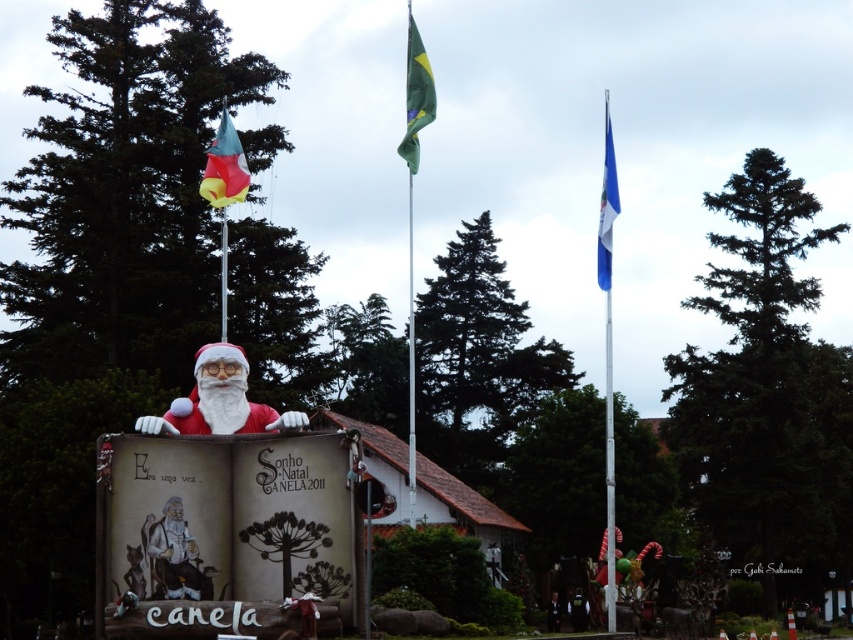
You are a guest at the holiday celebration and want to take a photo with Santa Claus. You notice two blue fabric flags. Which flag is taller? The blue fabric flag at upper right or the blue fabric flag at right?

The blue fabric flag at upper right is taller than the blue fabric flag at right.

You are planning to hang a new decorative banner between the blue fabric flag at upper right and the blue fabric flag at right. The banner requires 80 feet of space to be displayed properly. Based on the current setup, will there be enough space between these two flags to accommodate the banner?

The blue fabric flag at upper right and blue fabric flag at right are 77.15 feet apart from each other. Since the required space for the banner is 80 feet, there isn not enough space between them to accommodate the banner.